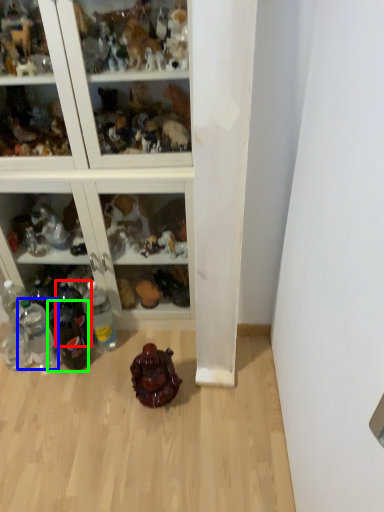
Question: Which object is positioned farthest from bottle (highlighted by a red box)? Select from bottle (highlighted by a blue box) and bottle (highlighted by a green box).

Choices:
 (A) bottle
 (B) bottle

Answer: (A)